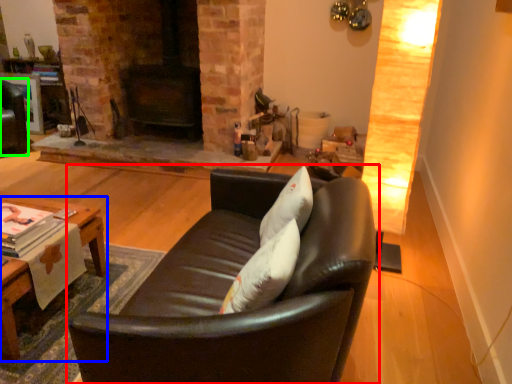
Question: Which is farther away from studio couch (highlighted by a red box)? table (highlighted by a blue box) or swivel chair (highlighted by a green box)?

Choices:
 (A) table
 (B) swivel chair

Answer: (B)